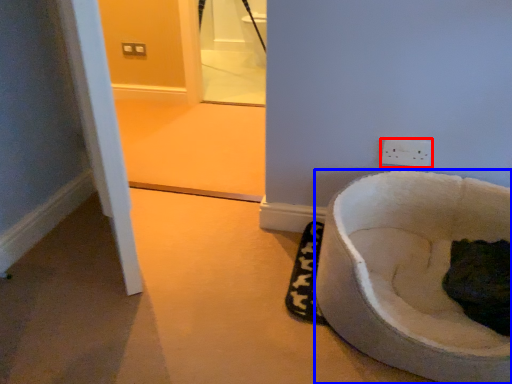
Question: Which object appears farthest to the camera in this image, power plugs and sockets (highlighted by a red box) or toilet (highlighted by a blue box)?

Choices:
 (A) power plugs and sockets
 (B) toilet

Answer: (A)